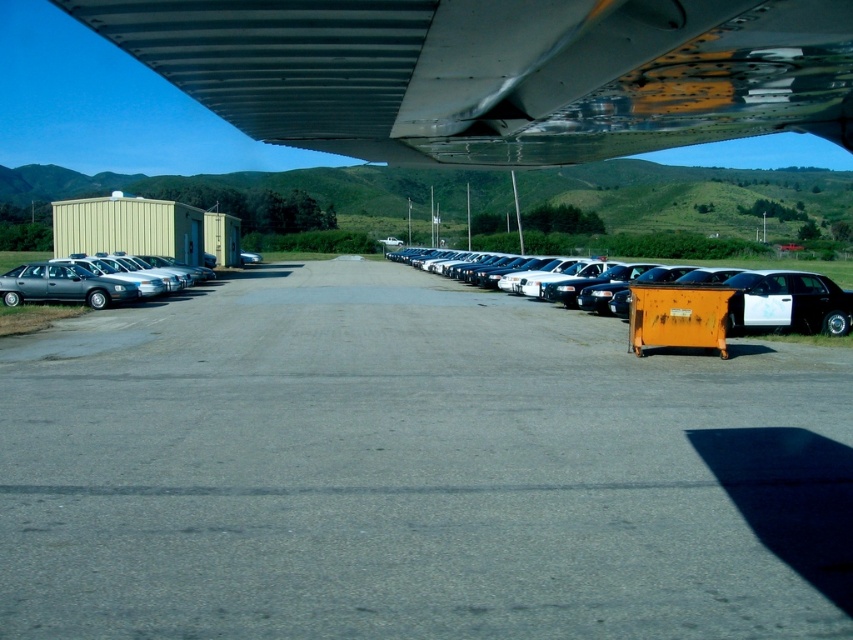
You are a drone operator trying to capture a photo of the metallic gray wing at upper center from directly above. Given the coordinates provided, can you confirm if the wing is positioned centrally within the image frame?

The metallic gray wing at upper center is located at coordinates point (x=497, y=72), which means it is not exactly at the center of the image frame. The center would be at (x=426, y=320), so the wing is shifted towards the left and lower side compared to the true center.

You are a security guard at the airport. You need to check both the metallic silver sedan at center right and the metallic silver sedan at left. Which sedan should you check first if you want to start from the leftmost vehicle?

You should check the metallic silver sedan at left first because it is positioned to the left of the metallic silver sedan at center right.